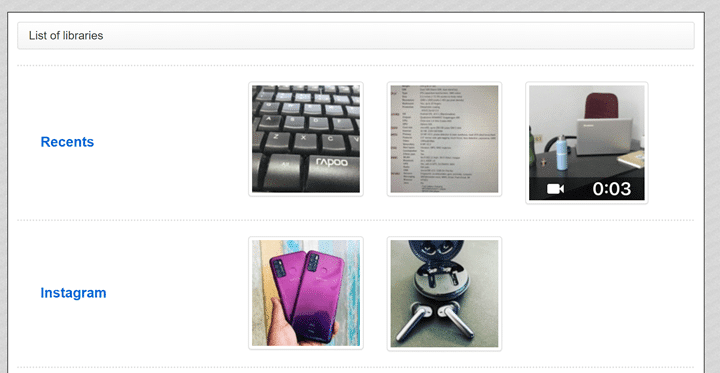
This screenshot has width=720, height=373. Find the location of `items on a desk`. items on a desk is located at coordinates (638, 154), (562, 155), (600, 137), (567, 149), (544, 164), (535, 151).